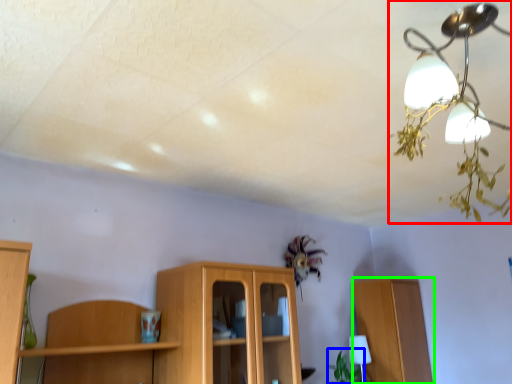
Question: Which object is positioned closest to lamp (highlighted by a red box)? Select from plant (highlighted by a blue box) and cabinetry (highlighted by a green box).

Choices:
 (A) plant
 (B) cabinetry

Answer: (B)